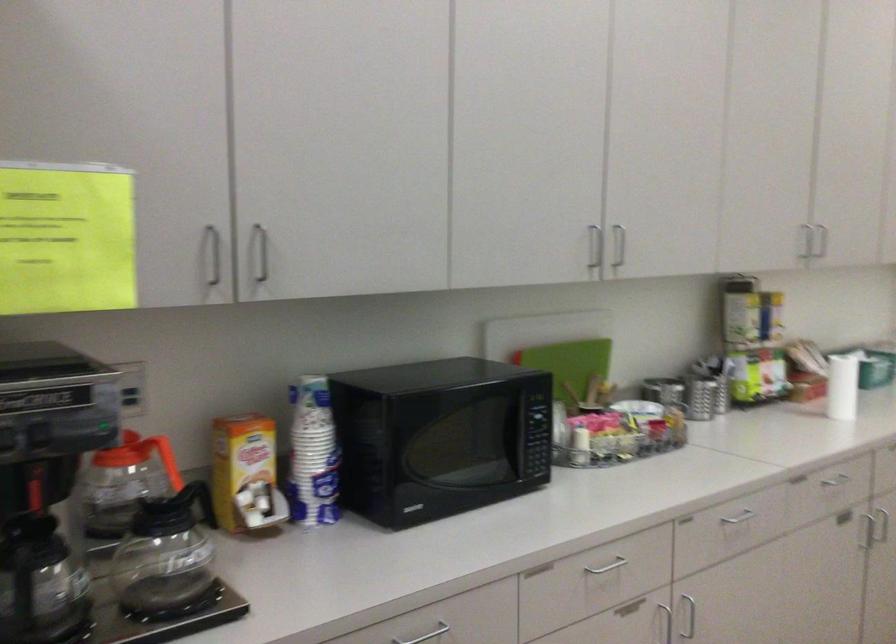
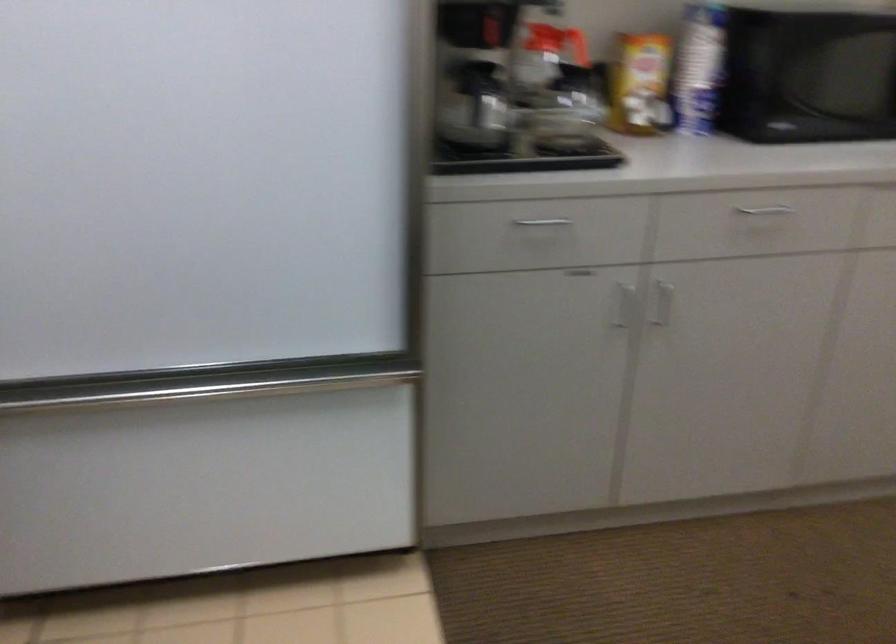
In the second image, find the point that corresponds to [203,502] in the first image.

(604, 106)